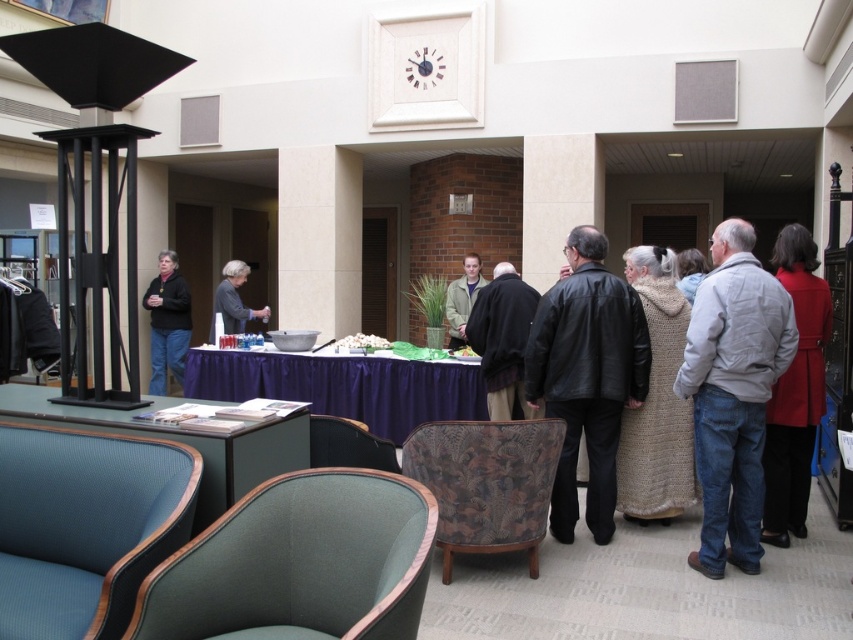
Does black leather jacket at center have a greater height compared to gray wool sweater at center?

Yes.

Is black leather jacket at center positioned before gray wool sweater at center?

Yes, it is.

Between point (525, 394) and point (236, 330), which one is positioned in front?

Positioned in front is point (525, 394).

Identify the location of black leather jacket at center. (585, 376).

Which is in front, point (21, 516) or point (476, 266)?

Point (21, 516) is more forward.

Locate an element on the screen. textured blue fabric armchair at lower left is located at coordinates (85, 528).

Based on the photo, can you confirm if red wool coat at right is positioned to the right of velvet dark brown armchair at lower center?

Correct, you'll find red wool coat at right to the right of velvet dark brown armchair at lower center.

Which is more to the right, red wool coat at right or velvet dark brown armchair at lower center?

red wool coat at right is more to the right.

Describe the element at coordinates (795, 390) in the screenshot. I see `red wool coat at right` at that location.

You are a GUI agent. You are given a task and a screenshot of the screen. Output one action in this format:
    pyautogui.click(x=<x>, y=<y>)
    Task: Click on the red wool coat at right
    Image resolution: width=853 pixels, height=640 pixels.
    Given the screenshot: What is the action you would take?
    pyautogui.click(x=795, y=390)